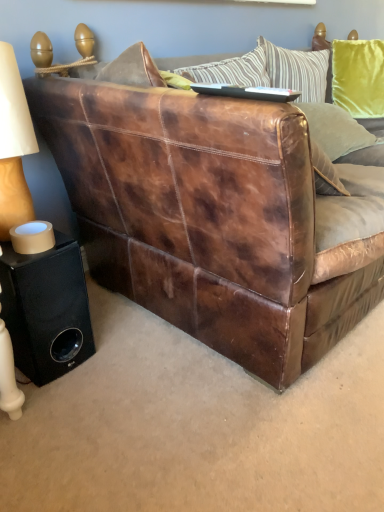
This screenshot has width=384, height=512. In order to click on unoccupied region to the right of black matte speaker at lower left in this screenshot , I will do `click(119, 352)`.